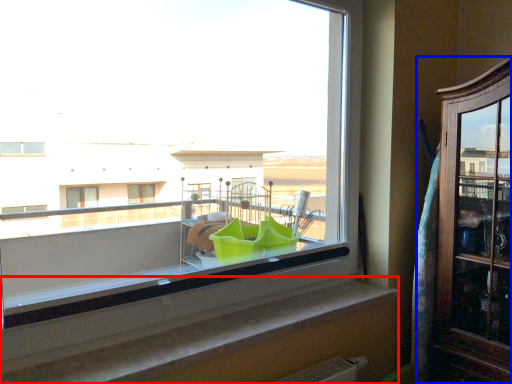
Question: Which of the following is the farthest to the observer, window sill (highlighted by a red box) or dresser (highlighted by a blue box)?

Choices:
 (A) window sill
 (B) dresser

Answer: (B)